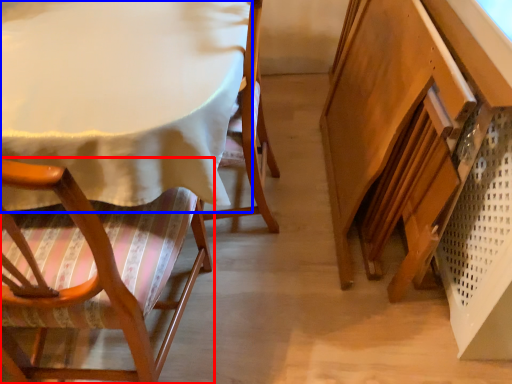
Question: Among these objects, which one is farthest to the camera, chair (highlighted by a red box) or table (highlighted by a blue box)?

Choices:
 (A) chair
 (B) table

Answer: (B)